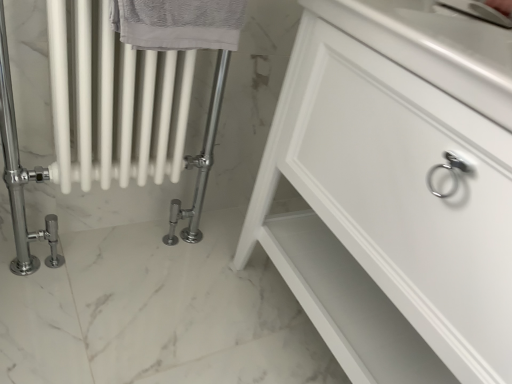
Question: Can you confirm if white glossy radiator at left is positioned to the left of white glossy cabinet at center?

Choices:
 (A) no
 (B) yes

Answer: (B)

Question: Considering the relative sizes of white glossy radiator at left and white glossy cabinet at center in the image provided, is white glossy radiator at left thinner than white glossy cabinet at center?

Choices:
 (A) no
 (B) yes

Answer: (B)

Question: Is white glossy radiator at left not near white glossy cabinet at center?

Choices:
 (A) no
 (B) yes

Answer: (A)

Question: Considering the relative sizes of white glossy radiator at left and white glossy cabinet at center in the image provided, is white glossy radiator at left taller than white glossy cabinet at center?

Choices:
 (A) yes
 (B) no

Answer: (B)

Question: Is white glossy radiator at left next to white glossy cabinet at center and touching it?

Choices:
 (A) yes
 (B) no

Answer: (B)

Question: Considering the relative sizes of white glossy radiator at left and white glossy cabinet at center in the image provided, is white glossy radiator at left bigger than white glossy cabinet at center?

Choices:
 (A) yes
 (B) no

Answer: (B)

Question: Is gray textured towel at upper left touching white glossy radiator at left?

Choices:
 (A) yes
 (B) no

Answer: (B)

Question: Is gray textured towel at upper left turned away from white glossy radiator at left?

Choices:
 (A) yes
 (B) no

Answer: (B)

Question: Considering the relative sizes of gray textured towel at upper left and white glossy radiator at left in the image provided, is gray textured towel at upper left bigger than white glossy radiator at left?

Choices:
 (A) no
 (B) yes

Answer: (A)

Question: Would you say white glossy radiator at left is part of gray textured towel at upper left's contents?

Choices:
 (A) no
 (B) yes

Answer: (A)

Question: Is gray textured towel at upper left far away from white glossy radiator at left?

Choices:
 (A) yes
 (B) no

Answer: (B)

Question: Is gray textured towel at upper left thinner than white glossy radiator at left?

Choices:
 (A) no
 (B) yes

Answer: (B)

Question: Is white glossy cabinet at center positioned behind white glossy radiator at left?

Choices:
 (A) no
 (B) yes

Answer: (A)